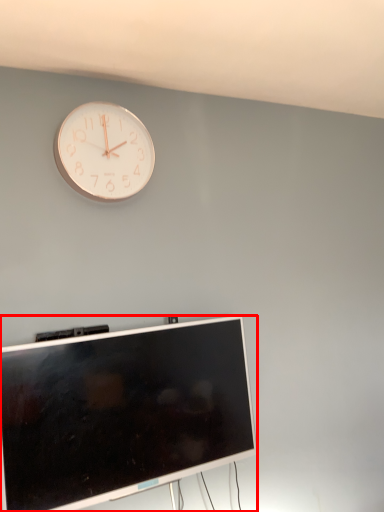
Question: From the image's perspective, what is the correct spatial positioning of television (annotated by the red box) in reference to wall clock?

Choices:
 (A) below
 (B) above

Answer: (A)